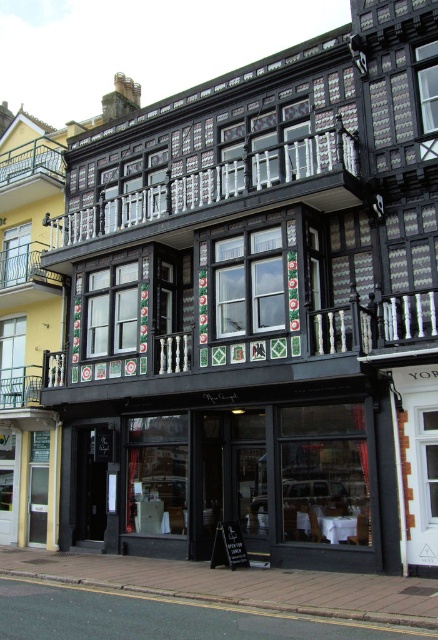
Which is behind, point (283, 442) or point (24, 412)?

The point (24, 412) is more distant.

Is black glass storefront at center positioned before matte black building at center?

Yes.

Where is `black glass storefront at center`? black glass storefront at center is located at coordinates (229, 477).